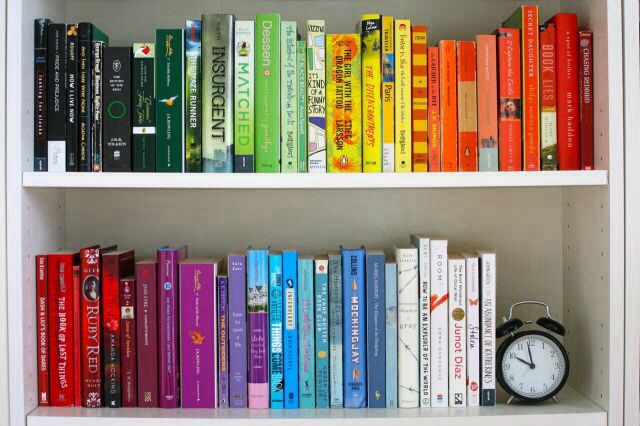
Image resolution: width=640 pixels, height=426 pixels. I want to click on blue books, so click(253, 273), click(273, 288), click(289, 277), click(300, 294), click(316, 309), click(336, 319), click(349, 330), click(374, 336), click(390, 323).